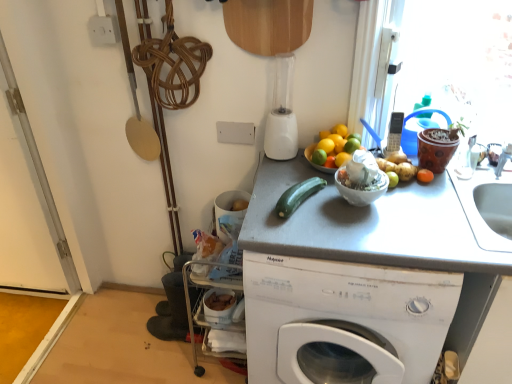
I want to click on vacant space to the left of orange matte at right, so click(393, 197).